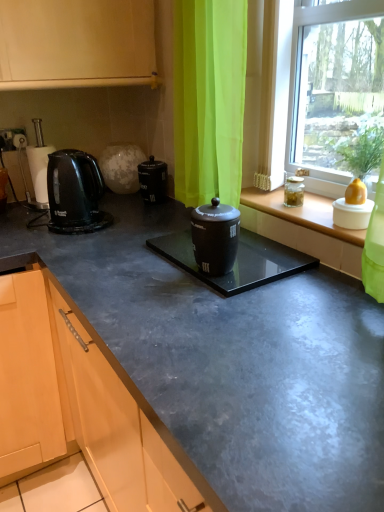
Question: Is matte black coffee canister at center inside or outside of black glossy container at center?

Choices:
 (A) outside
 (B) inside

Answer: (A)

Question: From a real-world perspective, is matte black coffee canister at center above or below black glossy container at center?

Choices:
 (A) below
 (B) above

Answer: (A)

Question: Estimate the real-world distances between objects in this image. Which object is closer to the transparent glass window at center?

Choices:
 (A) black glossy container at center
 (B) black plastic kettle at left
 (C) matte glass window sill at center
 (D) matte black coffee canister at center
 (E) black glossy electric kettle at left

Answer: (C)

Question: Which is farther from the matte black coffee canister at center?

Choices:
 (A) matte glass window sill at center
 (B) black glossy electric kettle at left
 (C) black glossy container at center
 (D) black plastic kettle at left
 (E) transparent glass window at center

Answer: (E)